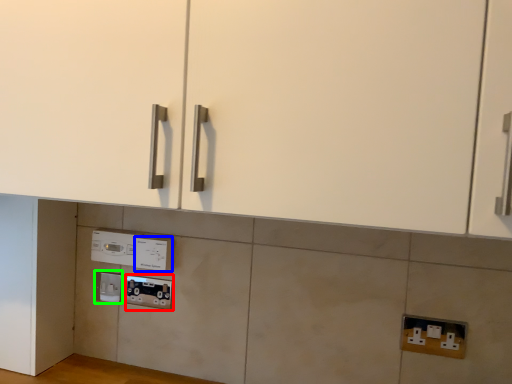
Question: Considering the real-world distances, which object is farthest from socket (highlighted by a red box)? electric outlet (highlighted by a blue box) or electric outlet (highlighted by a green box)?

Choices:
 (A) electric outlet
 (B) electric outlet

Answer: (B)